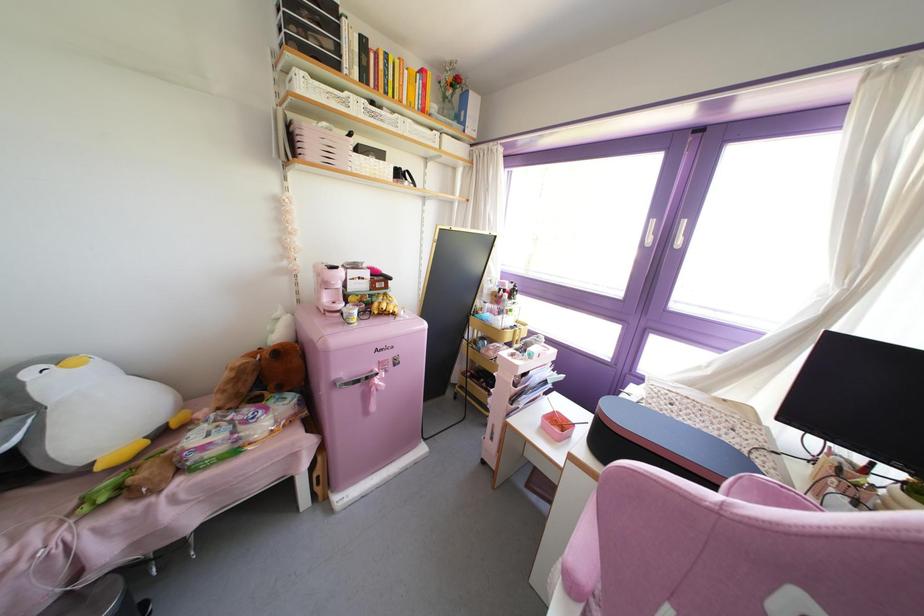
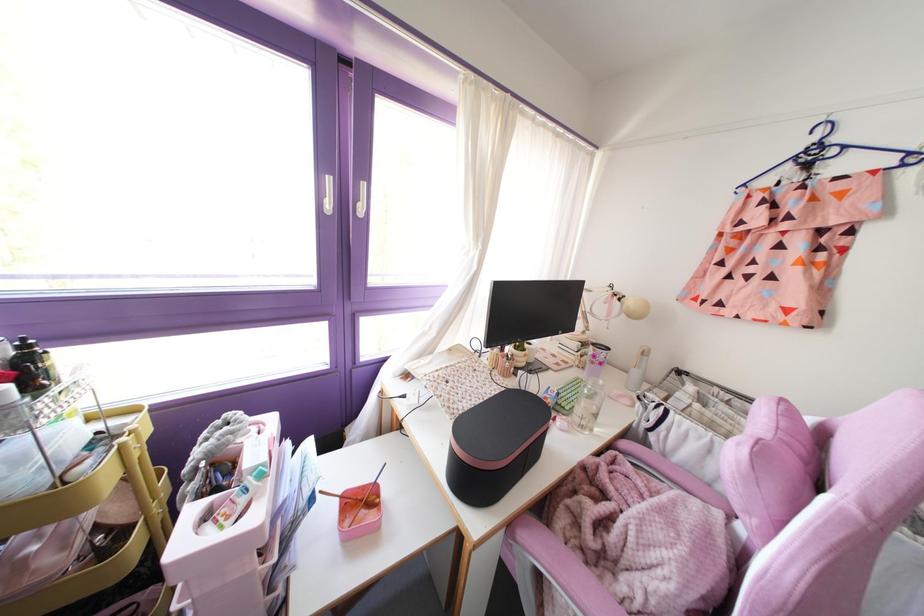
Where in the second image is the point corresponding to the point at 508,297 from the first image?

(32, 389)